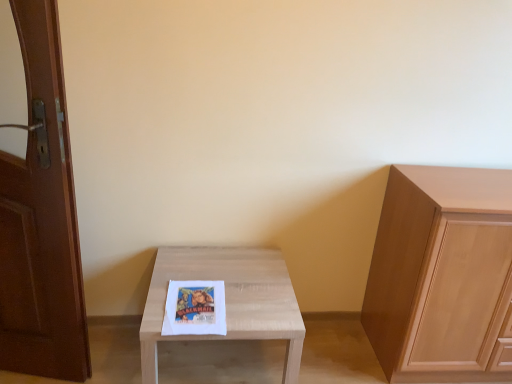
Find the location of `free point below brown wooden door at left (from a real-world perspective)`. free point below brown wooden door at left (from a real-world perspective) is located at coordinates (34, 375).